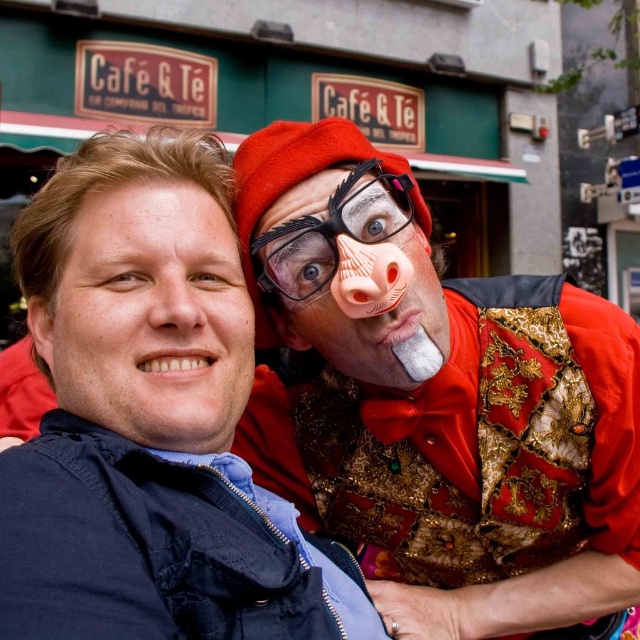
Question: Is blue fabric jacket at center wider than matte plastic clown nose at right?

Choices:
 (A) yes
 (B) no

Answer: (A)

Question: Which object appears farthest from the camera in this image?

Choices:
 (A) matte skin face at left
 (B) matte gold vest at right
 (C) matte plastic clown nose at right
 (D) blue fabric jacket at center

Answer: (B)

Question: Is blue fabric jacket at center in front of matte skin face at left?

Choices:
 (A) yes
 (B) no

Answer: (A)

Question: Estimate the real-world distances between objects in this image. Which object is closer to the matte skin face at left?

Choices:
 (A) matte plastic clown nose at right
 (B) blue fabric jacket at center

Answer: (B)

Question: Can you confirm if matte skin face at left is positioned above matte plastic clown nose at right?

Choices:
 (A) yes
 (B) no

Answer: (B)

Question: Which object is positioned farthest from the matte gold vest at right?

Choices:
 (A) matte skin face at left
 (B) matte plastic clown nose at right
 (C) blue fabric jacket at center

Answer: (A)